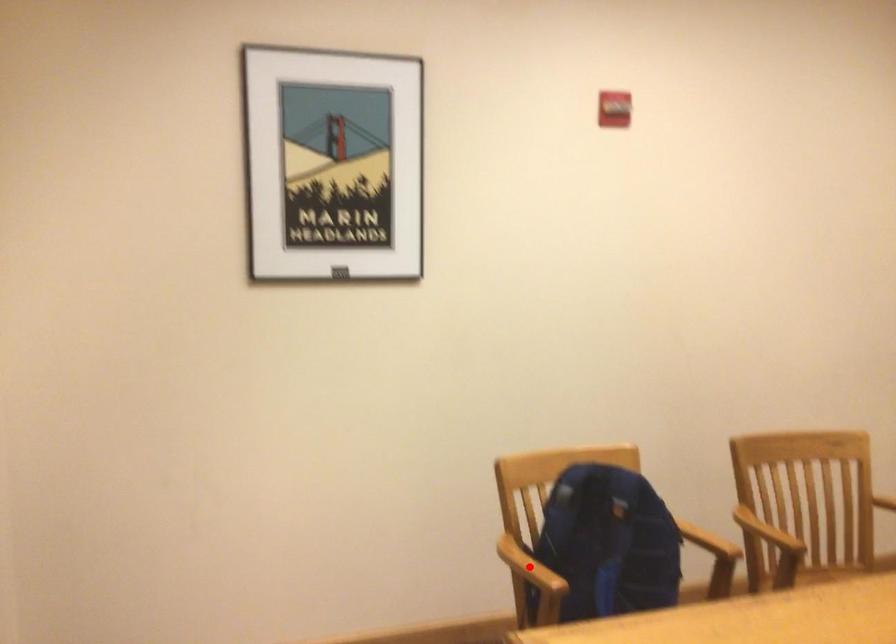
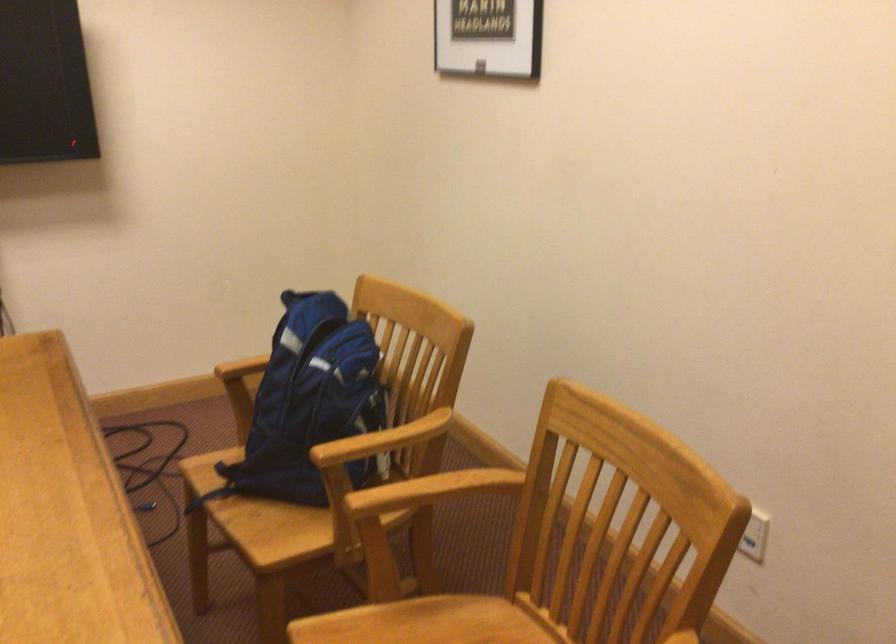
Question: I am providing you with two images of the same scene from different viewpoints. A red point is marked on the first image. Is the red point's position out of view in image 2?

Choices:
 (A) Yes
 (B) No

Answer: (A)